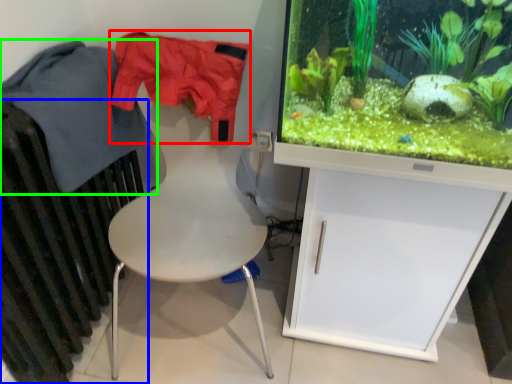
Question: Which object is positioned farthest from clothing (highlighted by a red box)? Select from radiator (highlighted by a blue box) and clothing (highlighted by a green box).

Choices:
 (A) radiator
 (B) clothing

Answer: (A)